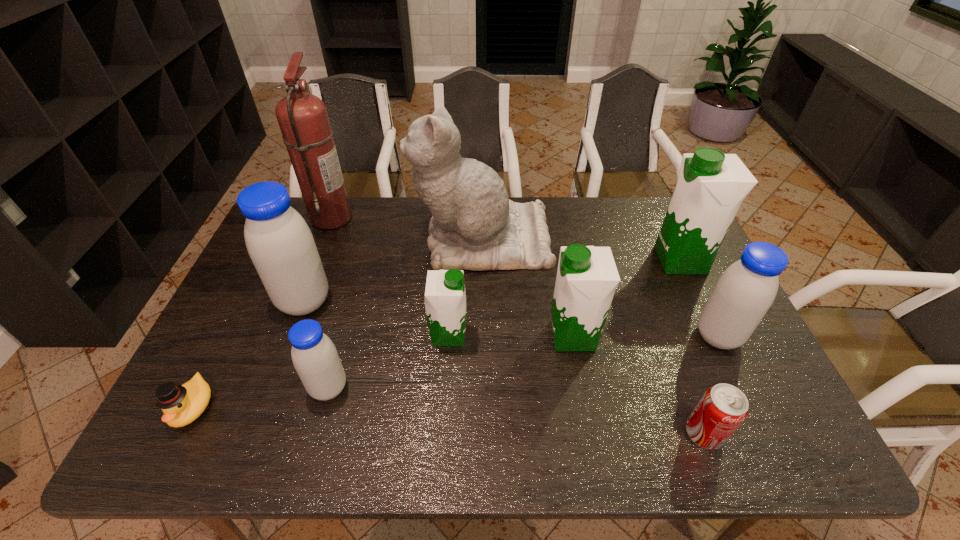
This screenshot has height=540, width=960. Find the location of `object located at the near left corner`. object located at the near left corner is located at coordinates (181, 405).

Locate an element on the screen. Image resolution: width=960 pixels, height=540 pixels. vacant space at the far edge of the desktop is located at coordinates click(324, 236).

In order to click on vacant space at the right edge in this screenshot , I will do `click(775, 418)`.

Where is `free space at the near left corner of the desktop`? free space at the near left corner of the desktop is located at coordinates (x=160, y=433).

The height and width of the screenshot is (540, 960). What are the coordinates of `free region at the far right corner of the desktop` in the screenshot? It's located at (653, 235).

Find the location of a particular element. This screenshot has height=540, width=960. free space at the near right corner is located at coordinates (740, 450).

Find the location of a particular element. Image resolution: width=960 pixels, height=540 pixels. vacant area between the biggest blue soya milk and the leftmost object is located at coordinates (249, 354).

What are the coordinates of `free space that is in between the smallest green soya milk and the fire extinguisher` in the screenshot? It's located at (390, 276).

Where is `vacant area between the leftmost soya milk and the ninth tallest object`? vacant area between the leftmost soya milk and the ninth tallest object is located at coordinates (504, 368).

The width and height of the screenshot is (960, 540). Find the location of `vacant region between the biggest green soya milk and the third object from right to left`. vacant region between the biggest green soya milk and the third object from right to left is located at coordinates (692, 347).